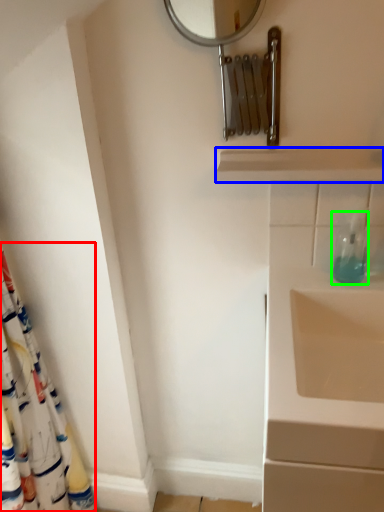
Question: Considering the real-world distances, which object is closest to shower curtain (highlighted by a red box)? balustrade (highlighted by a blue box) or soap dispenser (highlighted by a green box).

Choices:
 (A) balustrade
 (B) soap dispenser

Answer: (A)